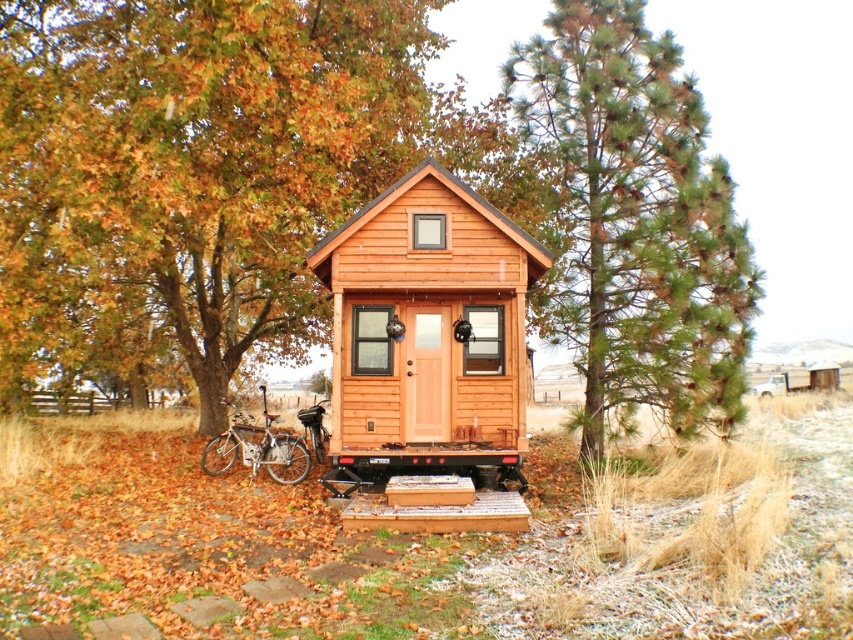
Is green leafy tree at left taller than wooden cabin at center?

Correct, green leafy tree at left is much taller as wooden cabin at center.

Can you confirm if green leafy tree at left is positioned below wooden cabin at center?

Incorrect, green leafy tree at left is not positioned below wooden cabin at center.

Is point (161, 45) closer to camera compared to point (482, 211)?

No.

Locate an element on the screen. The image size is (853, 640). green leafy tree at left is located at coordinates (189, 177).

Is the position of green leafy tree at left less distant than that of silver metallic bicycle at lower left?

Yes.

Is point (16, 209) behind point (289, 470)?

That is False.

The width and height of the screenshot is (853, 640). Describe the element at coordinates (189, 177) in the screenshot. I see `green leafy tree at left` at that location.

This screenshot has width=853, height=640. What are the coordinates of `green leafy tree at left` in the screenshot? It's located at (189, 177).

In the scene shown: Is green pine tree at right above wooden cabin at center?

Actually, green pine tree at right is below wooden cabin at center.

Does green pine tree at right have a greater height compared to wooden cabin at center?

No, green pine tree at right is not taller than wooden cabin at center.

Which is behind, point (511, 56) or point (347, 353)?

The point (511, 56) is more distant.

Locate an element on the screen. green pine tree at right is located at coordinates (635, 221).